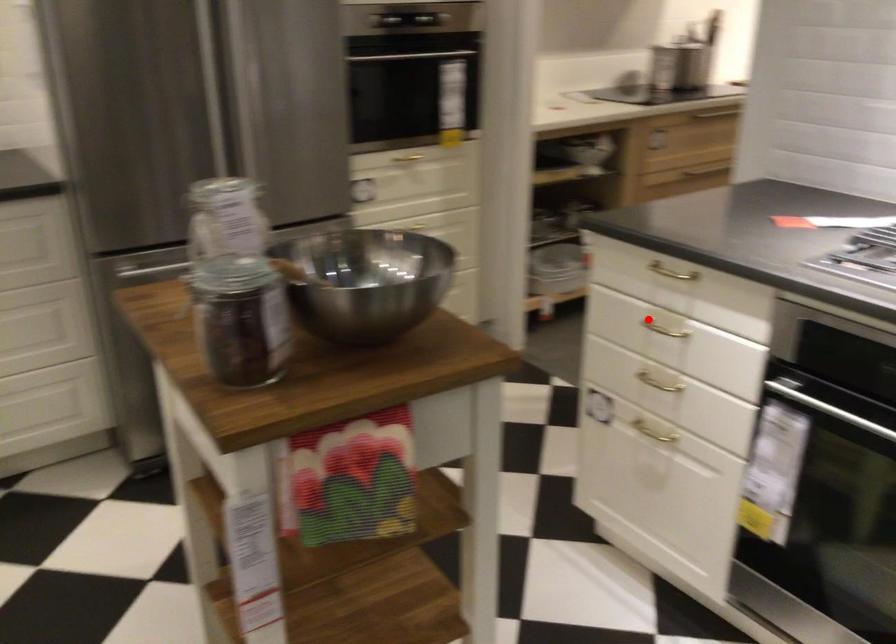
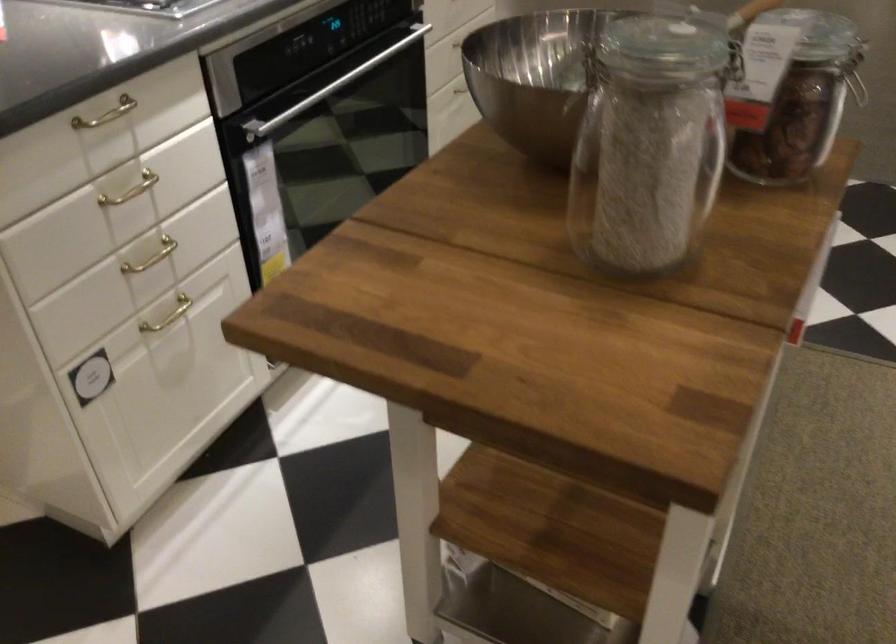
Question: I am providing you with two images of the same scene from different viewpoints. A red point is marked on the first image. At the location where the point appears in image 1, is it still visible in image 2?

Choices:
 (A) Yes
 (B) No

Answer: (A)